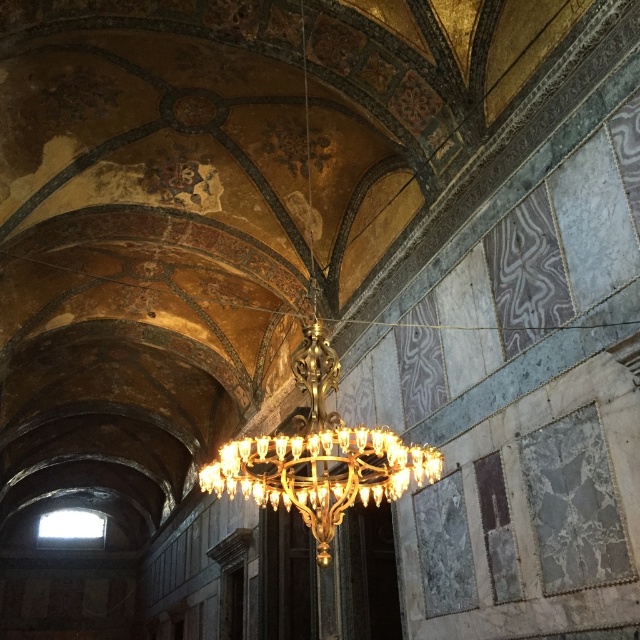
Question: Which point appears farthest from the camera in this image?

Choices:
 (A) (340, 445)
 (B) (349, 461)

Answer: (B)

Question: Which point is closer to the camera?

Choices:
 (A) gold metallic chandelier at center
 (B) gold/glass chandelier at center

Answer: (B)

Question: Is gold metallic chandelier at center closer to the viewer compared to gold/glass chandelier at center?

Choices:
 (A) no
 (B) yes

Answer: (A)

Question: Is gold metallic chandelier at center to the left of gold/glass chandelier at center from the viewer's perspective?

Choices:
 (A) no
 (B) yes

Answer: (B)

Question: Considering the relative positions of gold metallic chandelier at center and gold/glass chandelier at center in the image provided, where is gold metallic chandelier at center located with respect to gold/glass chandelier at center?

Choices:
 (A) left
 (B) right

Answer: (A)